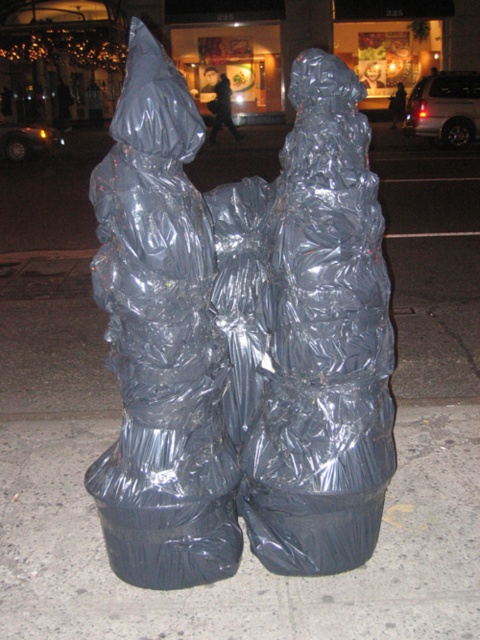
In order to click on clear plastic sculpture at center in this screenshot , I will do [311, 333].

Can you confirm if clear plastic sculpture at center is positioned to the left of satin silver sculpture at center?

Indeed, clear plastic sculpture at center is positioned on the left side of satin silver sculpture at center.

Identify the location of clear plastic sculpture at center. (311, 333).

Which is behind, point (464, 556) or point (340, 316)?

Positioned behind is point (464, 556).

Between point (74, 433) and point (370, 362), which one is positioned in front?

Point (370, 362)

Does point (109, 435) come behind point (389, 401)?

That is True.

Image resolution: width=480 pixels, height=640 pixels. Find the location of `black plastic bags at center`. black plastic bags at center is located at coordinates (243, 548).

Consider the image. Can you confirm if clear plastic sculpture at center is bigger than black plastic bags at center?

No.

Looking at this image, who is taller, clear plastic sculpture at center or black plastic bags at center?

Standing taller between the two is clear plastic sculpture at center.

Between point (220, 248) and point (44, 520), which one is positioned behind?

Positioned behind is point (44, 520).

This screenshot has height=640, width=480. I want to click on clear plastic sculpture at center, so click(x=311, y=333).